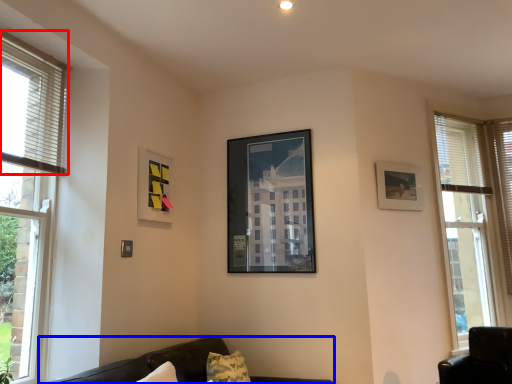
Question: Which point is closer to the camera, blind (highlighted by a red box) or studio couch (highlighted by a blue box)?

Choices:
 (A) blind
 (B) studio couch

Answer: (B)